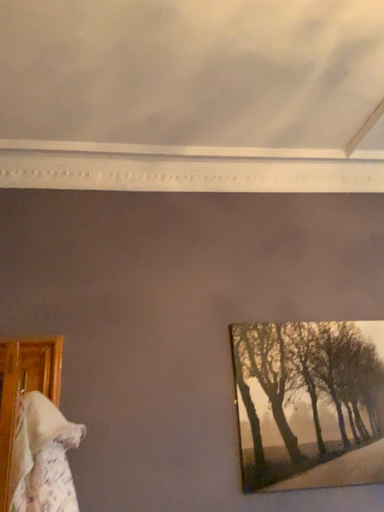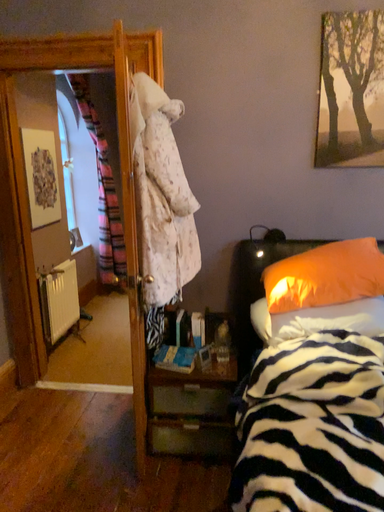
Question: How did the camera likely rotate when shooting the video?

Choices:
 (A) rotated left
 (B) rotated right

Answer: (A)